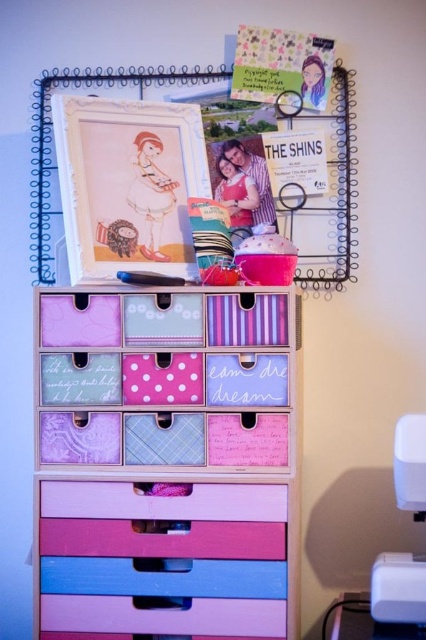
Who is positioned more to the left, pastel wood drawers at center or white plastic sewing machine at lower right?

Positioned to the left is pastel wood drawers at center.

Who is more forward, (x=164, y=504) or (x=417, y=454)?

Point (x=417, y=454) is in front.

Find the location of `pastel wood drawers at center`. pastel wood drawers at center is located at coordinates (167, 456).